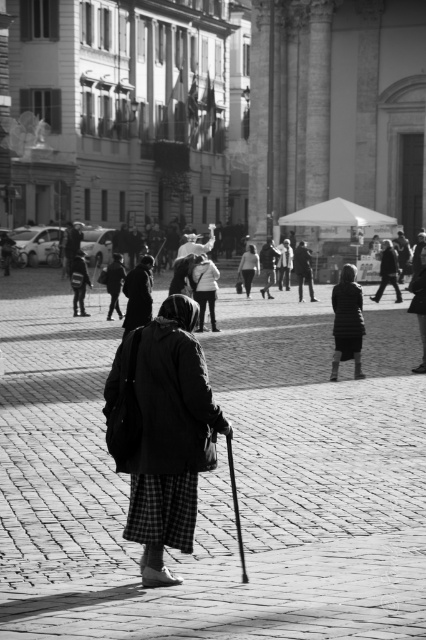
Question: Can you confirm if dark textured coat at center is positioned to the right of light gray fabric coat at center?

Choices:
 (A) no
 (B) yes

Answer: (A)

Question: In this image, where is dark textured coat at center located relative to light gray fabric coat at center?

Choices:
 (A) below
 (B) above

Answer: (A)

Question: Among these points, which one is farthest from the camera?

Choices:
 (A) (201, 432)
 (B) (256, 262)

Answer: (B)

Question: Can you confirm if dark textured coat at center is positioned above light gray fabric coat at center?

Choices:
 (A) no
 (B) yes

Answer: (A)

Question: Which point is closer to the camera?

Choices:
 (A) light gray fabric coat at center
 (B) dark textured coat at center

Answer: (B)

Question: Which point appears closest to the camera in this image?

Choices:
 (A) (157, 355)
 (B) (256, 269)

Answer: (A)